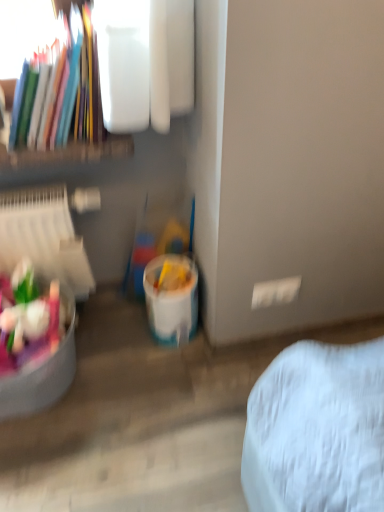
This screenshot has width=384, height=512. In order to click on free space in front of matte plastic toys at lower left in this screenshot , I will do `click(51, 462)`.